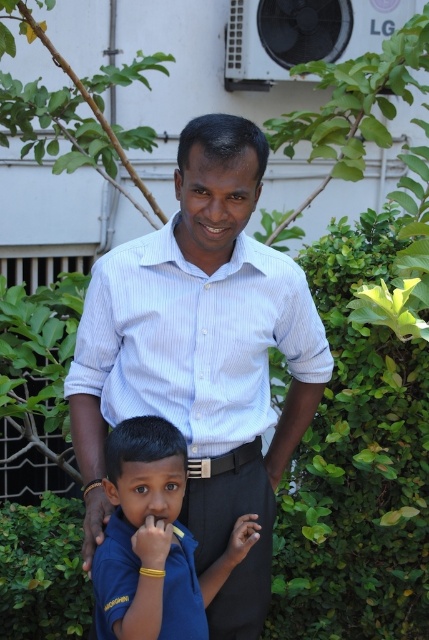
Question: Is white striped shirt at center below smooth skin hand at lower center?

Choices:
 (A) no
 (B) yes

Answer: (A)

Question: Is the position of dark skin hand at lower left more distant than that of smooth skin hand at lower center?

Choices:
 (A) yes
 (B) no

Answer: (B)

Question: Which of the following is the farthest from the observer?

Choices:
 (A) (227, 157)
 (B) (236, 355)
 (C) (245, 516)
 (D) (153, 518)

Answer: (C)

Question: Which point appears closest to the camera in this image?

Choices:
 (A) (290, 257)
 (B) (145, 340)
 (C) (144, 534)

Answer: (C)

Question: Is white striped shirt at center positioned before light blue striped shirt at center?

Choices:
 (A) no
 (B) yes

Answer: (B)

Question: Which object is positioned closest to the blue fabric shirt at lower center?

Choices:
 (A) light blue striped shirt at center
 (B) dark skin hand at lower left
 (C) white striped shirt at center
 (D) yellow matte bracelet at lower center

Answer: (D)